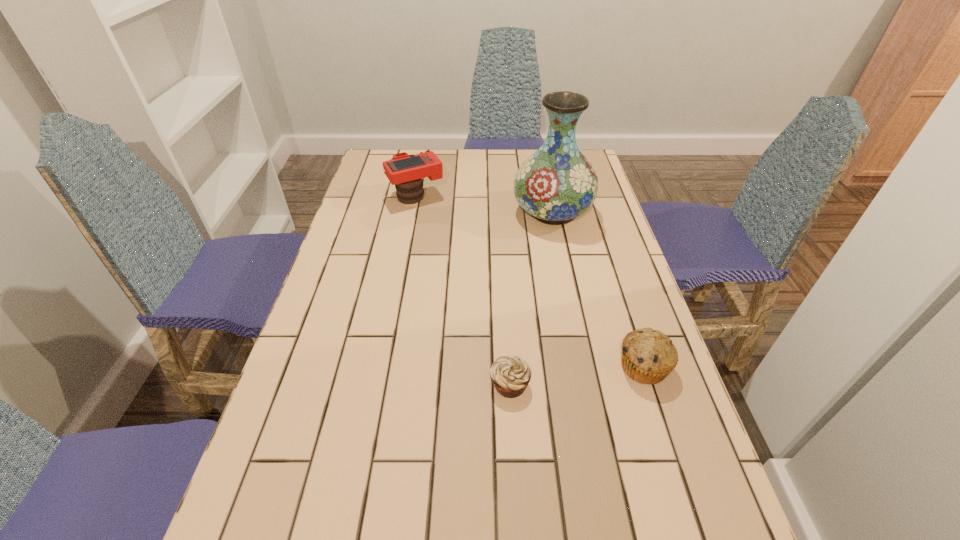
The height and width of the screenshot is (540, 960). Identify the location of vase. [x=557, y=183].

The height and width of the screenshot is (540, 960). In order to click on camera in this screenshot , I will do `click(405, 171)`.

Identify the location of the second tallest object. (405, 171).

Find the location of a particular element. The image size is (960, 540). the third tallest object is located at coordinates (648, 356).

You are a GUI agent. You are given a task and a screenshot of the screen. Output one action in this format:
    pyautogui.click(x=<x>, y=<y>)
    Task: Click on the taller muffin
    Image resolution: width=960 pixels, height=540 pixels.
    Given the screenshot: What is the action you would take?
    pyautogui.click(x=648, y=356)

Find the location of `the left muffin`. the left muffin is located at coordinates (510, 375).

Identify the location of the shortest object. (510, 375).

This screenshot has height=540, width=960. In order to click on free space located 0.280m on the front of the tallest object in this screenshot , I will do `click(571, 305)`.

At what (x,y) coordinates should I click in order to perform the action: click on vacant area located on the right of the third shortest object. Please return your answer as a coordinate pair (x, y). Looking at the image, I should click on (463, 196).

Locate an element on the screen. Image resolution: width=960 pixels, height=540 pixels. vacant position located on the front of the right muffin is located at coordinates pos(693,519).